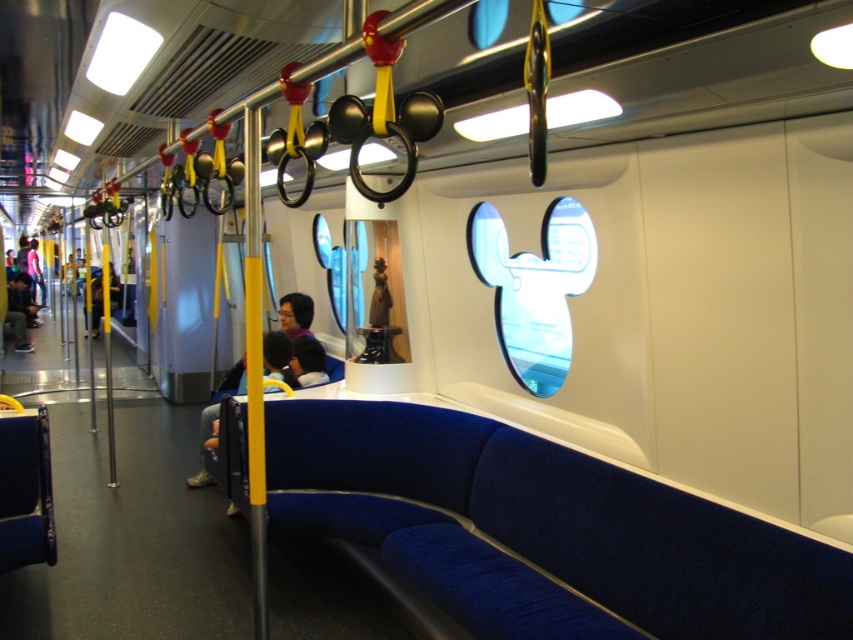
Can you confirm if matte blue pants at center is bigger than matte black jacket at left?

No, matte blue pants at center is not bigger than matte black jacket at left.

Identify the location of matte blue pants at center. Image resolution: width=853 pixels, height=640 pixels. 287,336.

Who is higher up, blue fabric seat at center or matte black jacket at left?

matte black jacket at left is higher up.

Measure the distance between blue fabric seat at center and matte black jacket at left.

blue fabric seat at center is 43.08 feet from matte black jacket at left.

The image size is (853, 640). Find the location of `blue fabric seat at center`. blue fabric seat at center is located at coordinates (543, 531).

Who is shorter, transparent plastic window at center or matte black jacket at left?

transparent plastic window at center

Which is above, transparent plastic window at center or matte black jacket at left?

matte black jacket at left is higher up.

The height and width of the screenshot is (640, 853). Describe the element at coordinates (534, 288) in the screenshot. I see `transparent plastic window at center` at that location.

The image size is (853, 640). Find the location of `transparent plastic window at center`. transparent plastic window at center is located at coordinates (534, 288).